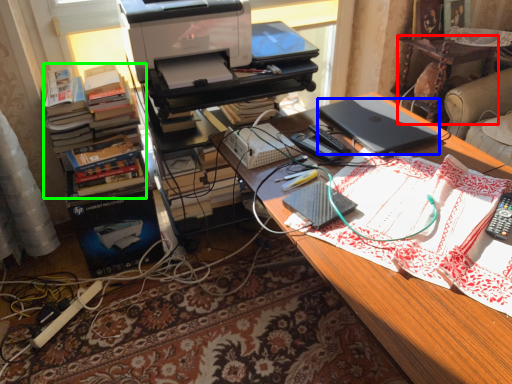
Question: Based on their relative distances, which object is farther from computer desk (highlighted by a red box)? Choose from laptop (highlighted by a blue box) and book (highlighted by a green box).

Choices:
 (A) laptop
 (B) book

Answer: (B)